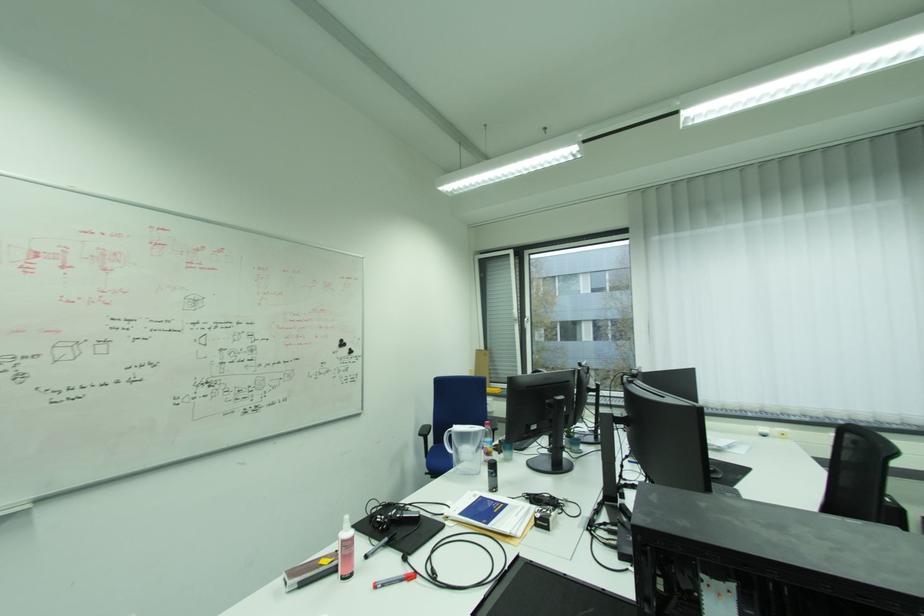
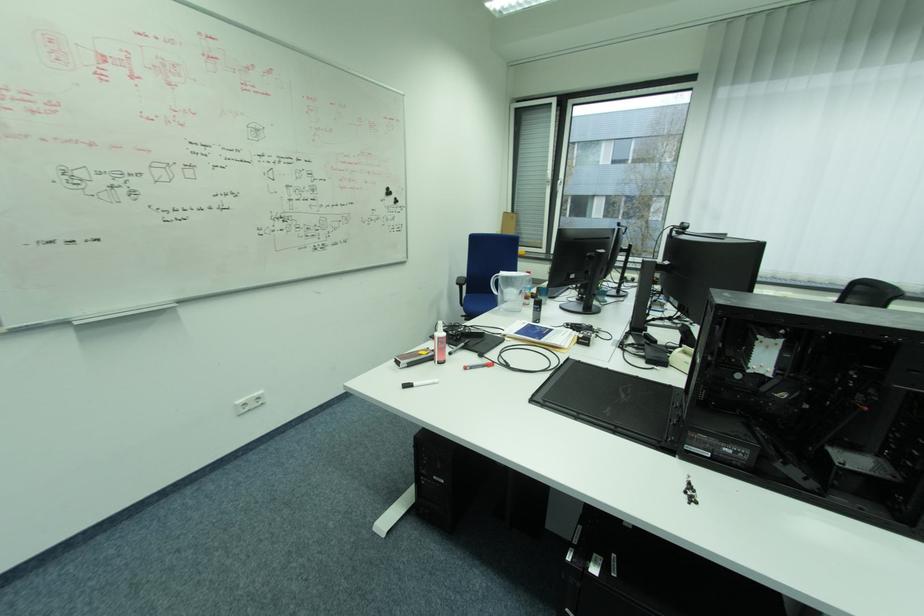
The point at (342, 578) is marked in the first image. Where is the corresponding point in the second image?

(439, 363)